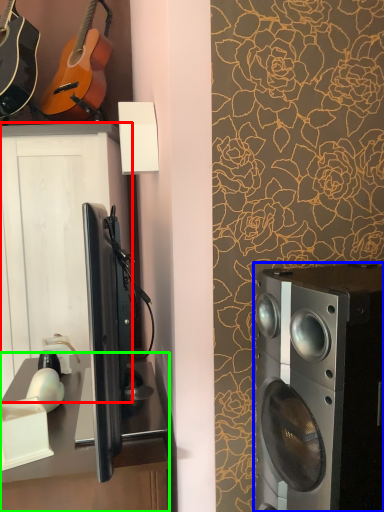
Question: Which object is the farthest from cabinetry (highlighted by a red box)? Choose among these: home appliance (highlighted by a blue box) or desk (highlighted by a green box).

Choices:
 (A) home appliance
 (B) desk

Answer: (A)